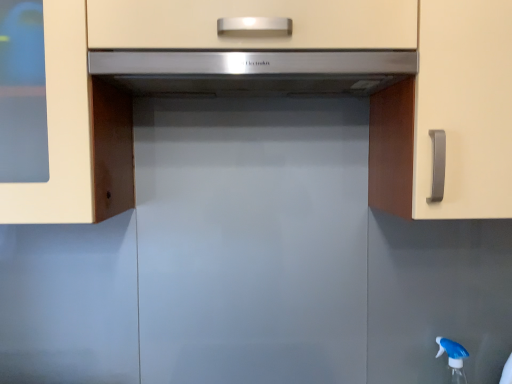
Question: Can you confirm if blue translucent spray bottle at lower right is bigger than satin silver range hood at center?

Choices:
 (A) yes
 (B) no

Answer: (B)

Question: Does blue translucent spray bottle at lower right turn towards satin silver range hood at center?

Choices:
 (A) yes
 (B) no

Answer: (B)

Question: From a real-world perspective, is blue translucent spray bottle at lower right below satin silver range hood at center?

Choices:
 (A) yes
 (B) no

Answer: (A)

Question: Is the depth of blue translucent spray bottle at lower right greater than that of satin silver range hood at center?

Choices:
 (A) no
 (B) yes

Answer: (B)

Question: From a real-world perspective, does blue translucent spray bottle at lower right stand above satin silver range hood at center?

Choices:
 (A) no
 (B) yes

Answer: (A)

Question: Is blue translucent spray bottle at lower right shorter than satin silver range hood at center?

Choices:
 (A) no
 (B) yes

Answer: (A)

Question: Considering the relative positions of matte white cabinet at center and satin silver range hood at center in the image provided, is matte white cabinet at center behind satin silver range hood at center?

Choices:
 (A) yes
 (B) no

Answer: (B)

Question: Can you confirm if matte white cabinet at center is thinner than satin silver range hood at center?

Choices:
 (A) yes
 (B) no

Answer: (B)

Question: From the image's perspective, is matte white cabinet at center below satin silver range hood at center?

Choices:
 (A) no
 (B) yes

Answer: (B)

Question: Can you confirm if matte white cabinet at center is positioned to the right of satin silver range hood at center?

Choices:
 (A) yes
 (B) no

Answer: (A)

Question: Is matte white cabinet at center looking in the opposite direction of satin silver range hood at center?

Choices:
 (A) no
 (B) yes

Answer: (B)

Question: Does matte white cabinet at center lie in front of satin silver range hood at center?

Choices:
 (A) yes
 (B) no

Answer: (A)

Question: From the image's perspective, is satin silver range hood at center on top of matte white cabinet at center?

Choices:
 (A) no
 (B) yes

Answer: (B)